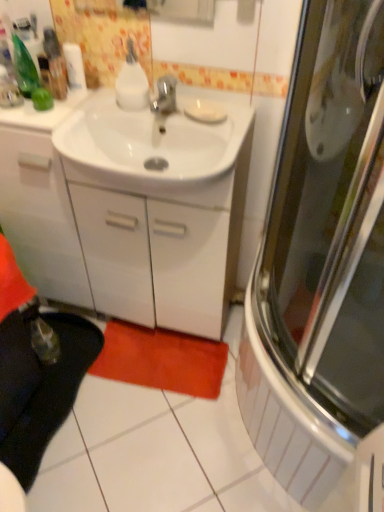
Locate an element on the screen. Image resolution: width=384 pixels, height=512 pixels. empty space that is ontop of white glossy cabinet at center is located at coordinates (96, 106).